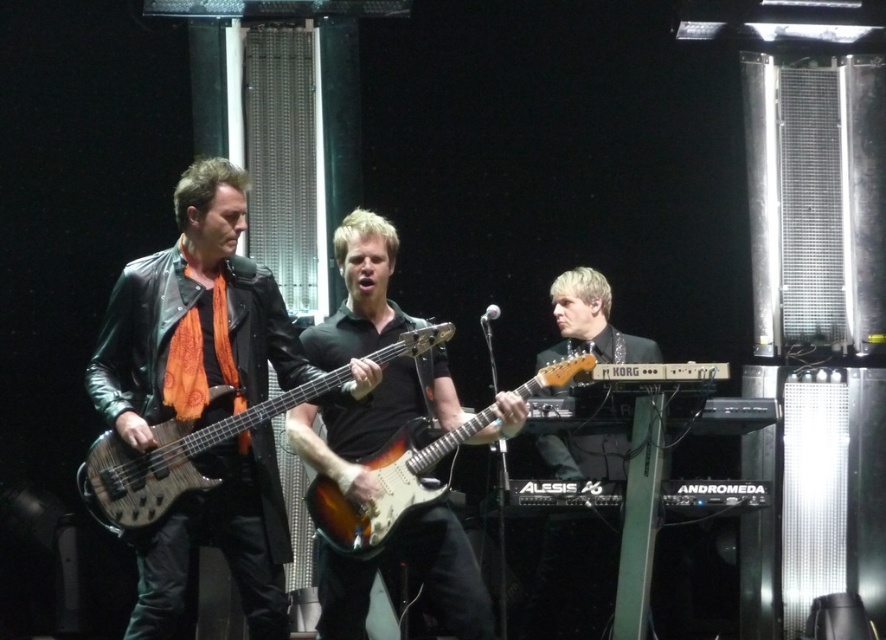
Question: Which of the following is the farthest from the observer?

Choices:
 (A) (425, 516)
 (B) (361, 536)
 (C) (216, 291)

Answer: (A)

Question: Which object appears farthest from the camera in this image?

Choices:
 (A) black matte guitar at center
 (B) leather jacket at left
 (C) wooden electric guitar at center
 (D) sunburst wood electric guitar at center

Answer: (A)

Question: Does shiny black guitar at right appear on the right side of sunburst wood electric guitar at center?

Choices:
 (A) yes
 (B) no

Answer: (A)

Question: Which is farther from the shiny black guitar at right?

Choices:
 (A) black matte guitar at center
 (B) wooden electric guitar at center
 (C) leather jacket at left
 (D) sunburst wood electric guitar at center

Answer: (C)

Question: Is shiny black guitar at right smaller than sunburst wood electric guitar at center?

Choices:
 (A) no
 (B) yes

Answer: (B)

Question: Can you confirm if leather jacket at left is bigger than shiny black guitar at right?

Choices:
 (A) yes
 (B) no

Answer: (A)